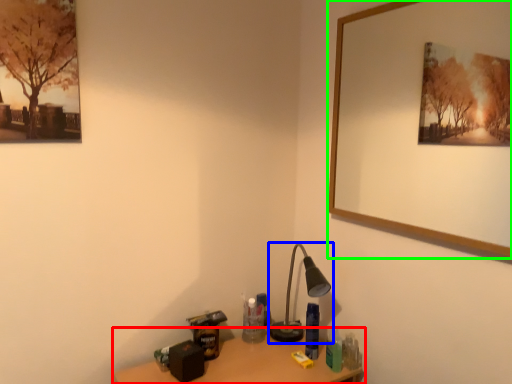
Question: Based on their relative distances, which object is nearer to table (highlighted by a red box)? Choose from lamp (highlighted by a blue box) and picture frame (highlighted by a green box).

Choices:
 (A) lamp
 (B) picture frame

Answer: (A)